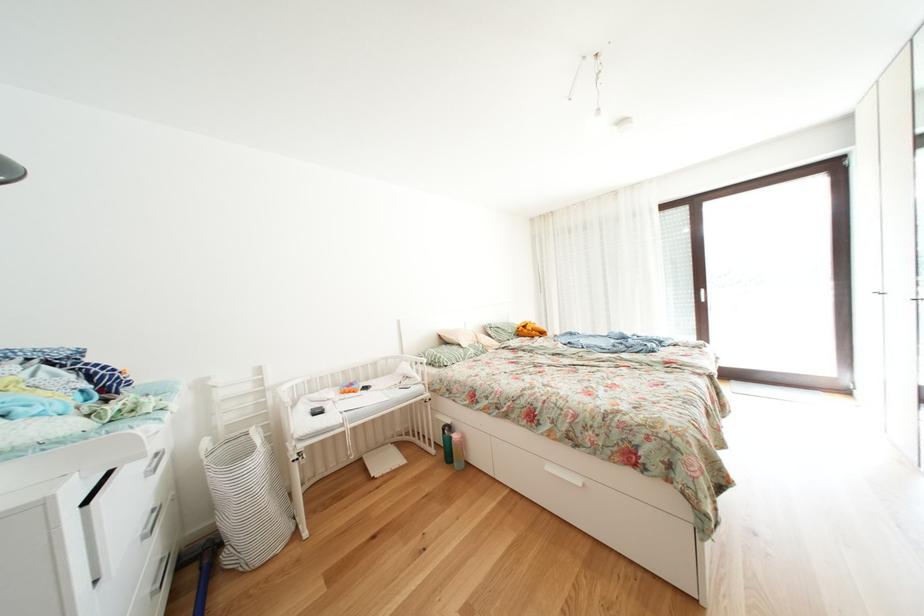
What do you see at coordinates (201, 590) in the screenshot? The image size is (924, 616). I see `a blue vacuum handle` at bounding box center [201, 590].